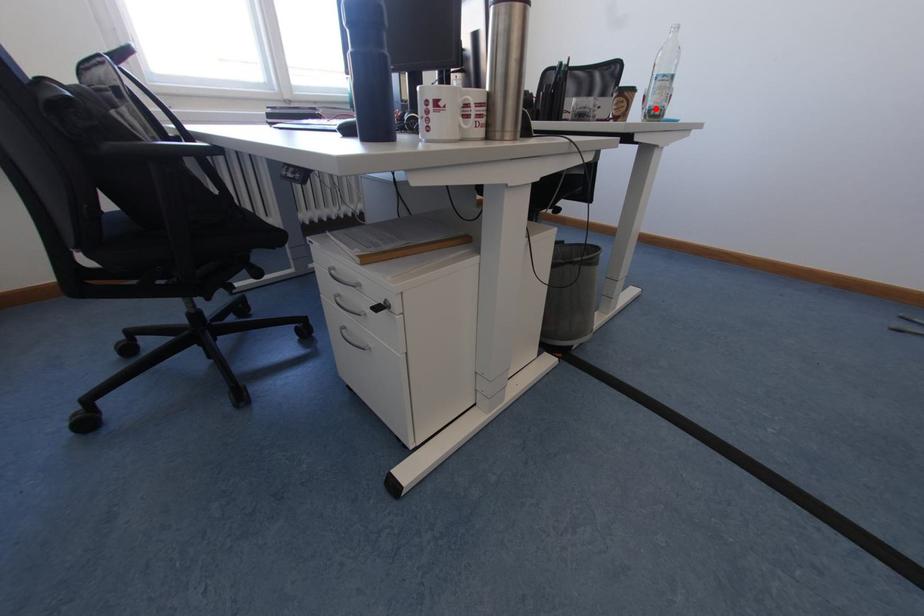
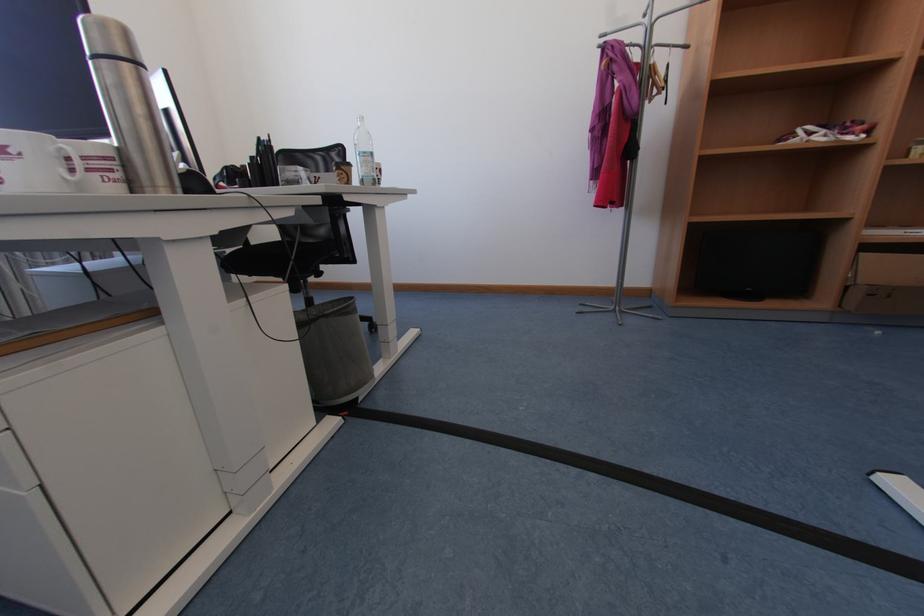
Locate, in the second image, the point that corresponds to the highlighted location in the first image.

(369, 177)